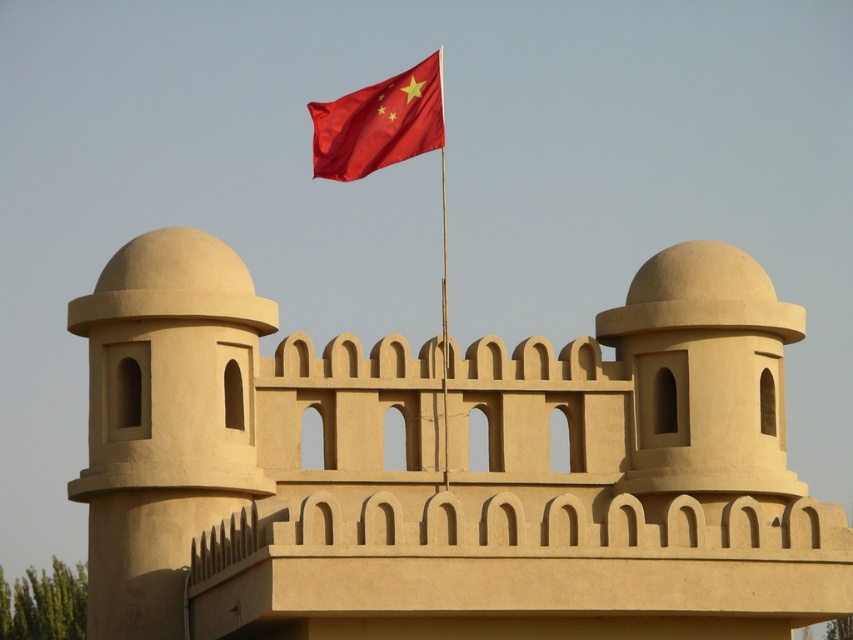
You are a tourist visiting this historical site and want to take a photo that includes both the matte beige tower at left and the smooth red flag at upper center. Which object should you position closer to the foreground to ensure both are in focus?

Since the matte beige tower at left is taller than the smooth red flag at upper center, positioning the matte beige tower at left closer to the foreground will help keep both objects in focus as the depth of field will cover both the nearer tower and the flag further back.

You are a historian examining the image of the fortification. You notice the beige stone fort at center and the smooth red flag at upper center. Which object is positioned higher in the image?

The beige stone fort at center is taller than the smooth red flag at upper center, so the beige stone fort at center is positioned higher in the image.

You are standing at a safe distance from the beige stone fort at center. If you want to take a photo that captures the entire structure, would you need to move closer or stay where you are?

The beige stone fort at center is 70.89 meters away from the viewer. To capture the entire structure in a photo, you would need to move closer to ensure the fort fits within the camera frame.